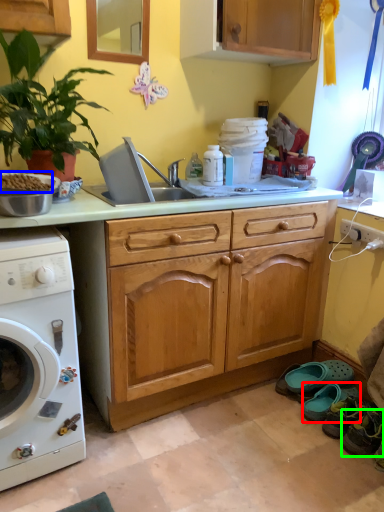
Question: Considering the real-world distances, which object is closest to shoe (highlighted by a red box)? food (highlighted by a blue box) or shoe (highlighted by a green box).

Choices:
 (A) food
 (B) shoe

Answer: (B)